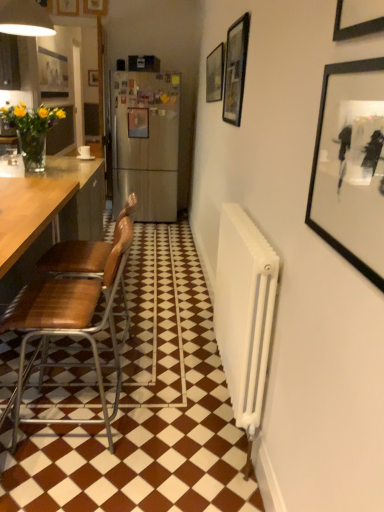
Question: Looking at their shapes, would you say matte black picture frame at upper center, arranged as the fifth picture frame when viewed from the right, is wider or thinner than matte black picture frame at upper center, arranged as the fourth picture frame when viewed from the back?

Choices:
 (A) wide
 (B) thin

Answer: (B)

Question: From the image's perspective, relative to matte black picture frame at upper center, acting as the fourth picture frame starting from the left, is matte black picture frame at upper center, the 2th picture frame positioned from the left, above or below?

Choices:
 (A) above
 (B) below

Answer: (A)

Question: Based on their relative distances, which object is farther from the wooden picture frame at upper center, placed as the 5th picture frame when sorted from front to back?

Choices:
 (A) brown leather chair at left, positioned as the 1th chair in back-to-front order
 (B) matte black picture frame at upper center, acting as the second picture frame starting from the top
 (C) white glossy tile at center
 (D) brown leather chair at left, which is the second chair in back-to-front order
 (E) black glass picture frame at upper center, which is counted as the 5th picture frame, starting from the back

Answer: (C)

Question: Which is farther from the metallic silver picture frame at center, the fourth picture frame from the bottom?

Choices:
 (A) black glass picture frame at upper center, positioned as the 2th picture frame in right-to-left order
 (B) wooden picture frame at upper center, positioned as the 6th picture frame in right-to-left order
 (C) brown leather chair at left, placed as the 1th chair when sorted from front to back
 (D) brown leather chair at left, positioned as the 2th chair in front-to-back order
 (E) matte black picture frame at upper center, acting as the fourth picture frame starting from the left

Answer: (C)